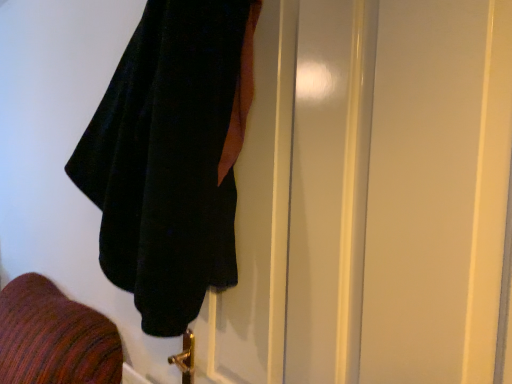
Question: Is velvet black towel at upper left taller or shorter than velvet black coat at upper left?

Choices:
 (A) short
 (B) tall

Answer: (A)

Question: From a real-world perspective, is velvet black towel at upper left positioned above or below velvet black coat at upper left?

Choices:
 (A) above
 (B) below

Answer: (A)

Question: In terms of size, does velvet black towel at upper left appear bigger or smaller than velvet black coat at upper left?

Choices:
 (A) small
 (B) big

Answer: (B)

Question: Is velvet black coat at upper left inside the boundaries of velvet black towel at upper left, or outside?

Choices:
 (A) inside
 (B) outside

Answer: (A)

Question: From a real-world perspective, is velvet black coat at upper left positioned above or below velvet black towel at upper left?

Choices:
 (A) below
 (B) above

Answer: (A)

Question: Looking at their shapes, would you say velvet black coat at upper left is wider or thinner than velvet black towel at upper left?

Choices:
 (A) thin
 (B) wide

Answer: (A)

Question: Considering their positions, is velvet black coat at upper left located in front of or behind velvet black towel at upper left?

Choices:
 (A) front
 (B) behind

Answer: (A)